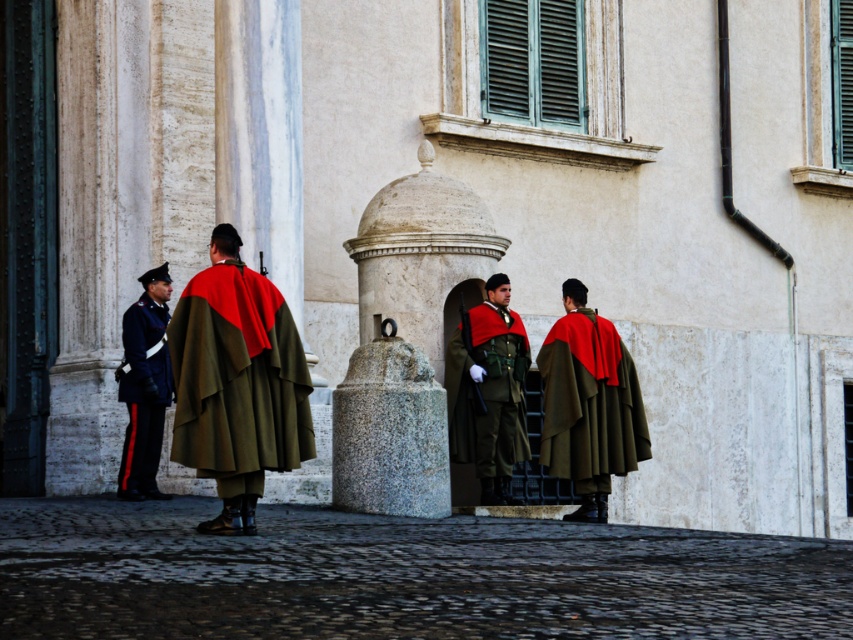
Question: Which object appears farthest from the camera in this image?

Choices:
 (A) shiny black uniform at left
 (B) matte olive-green cloak at right

Answer: (B)

Question: Does olive-green woolen cloak at center come in front of matte olive-green cloak at right?

Choices:
 (A) no
 (B) yes

Answer: (B)

Question: Does matte olive-green cloak at right have a smaller size compared to shiny black uniform at left?

Choices:
 (A) no
 (B) yes

Answer: (A)

Question: Estimate the real-world distances between objects in this image. Which object is closer to the shiny black uniform at left?

Choices:
 (A) matte olive-green cloak at right
 (B) matte green uniform at center

Answer: (B)

Question: Is olive-green woolen cloak at center further to the viewer compared to matte green uniform at center?

Choices:
 (A) no
 (B) yes

Answer: (A)

Question: Which point is farther from the camera taking this photo?

Choices:
 (A) (166, 314)
 (B) (489, 474)
 (C) (578, 365)

Answer: (B)